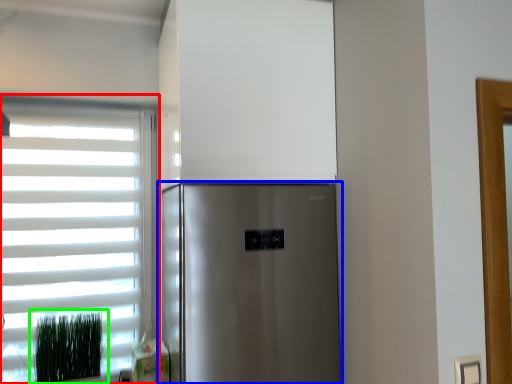
Question: Estimate the real-world distances between objects in this image. Which object is farther from window (highlighted by a red box), refrigerator (highlighted by a blue box) or plant (highlighted by a green box)?

Choices:
 (A) refrigerator
 (B) plant

Answer: (A)